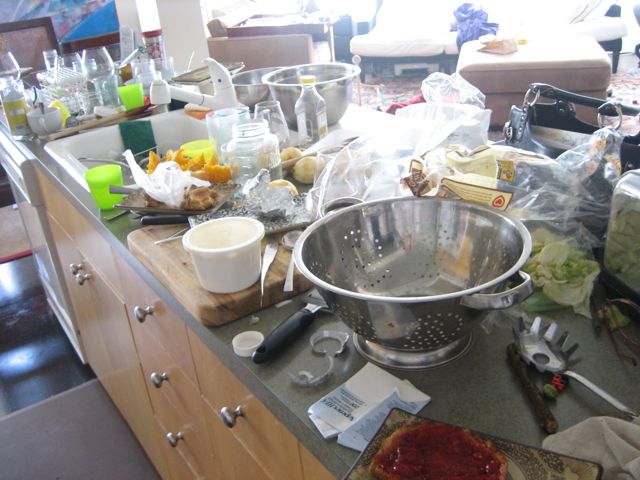
Identify the location of green cup. This screenshot has height=480, width=640. (102, 188), (130, 90), (60, 104).